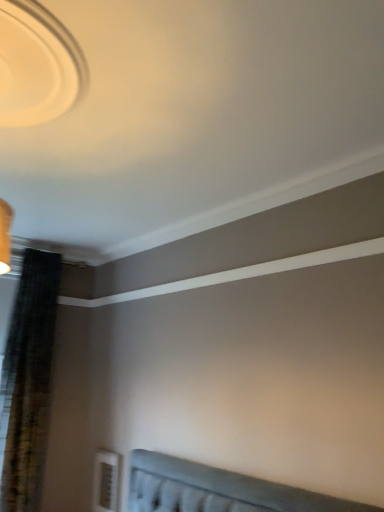
Describe the element at coordinates (28, 381) in the screenshot. I see `dark green textured curtain at left` at that location.

What is the approximate height of dark green textured curtain at left?

dark green textured curtain at left is 1.87 meters in height.

You are a GUI agent. You are given a task and a screenshot of the screen. Output one action in this format:
    pyautogui.click(x=<x>, y=<y>)
    Task: Click on the dark green textured curtain at left
    
    Given the screenshot: What is the action you would take?
    pyautogui.click(x=28, y=381)

Measure the distance between dark green textured curtain at left and camera.

A distance of 2.78 meters exists between dark green textured curtain at left and camera.

I want to click on dark green textured curtain at left, so click(x=28, y=381).